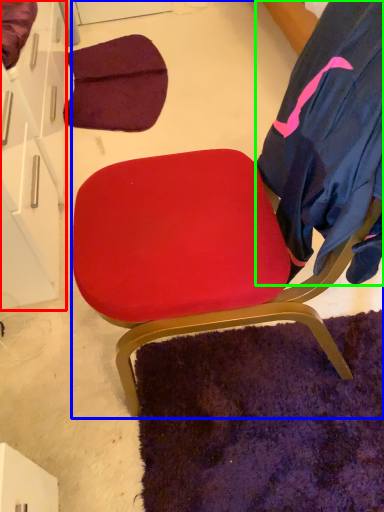
Question: Considering the real-world distances, which object is closest to drawer (highlighted by a red box)? chair (highlighted by a blue box) or robe (highlighted by a green box).

Choices:
 (A) chair
 (B) robe

Answer: (A)